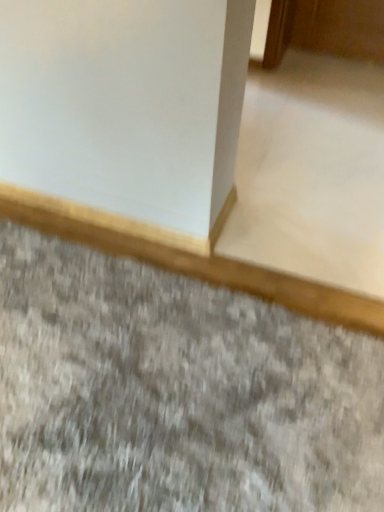
The height and width of the screenshot is (512, 384). Describe the element at coordinates (175, 392) in the screenshot. I see `gray carpet at lower left` at that location.

Identify the location of gray carpet at lower left. This screenshot has width=384, height=512. (175, 392).

This screenshot has height=512, width=384. I want to click on gray carpet at lower left, so click(175, 392).